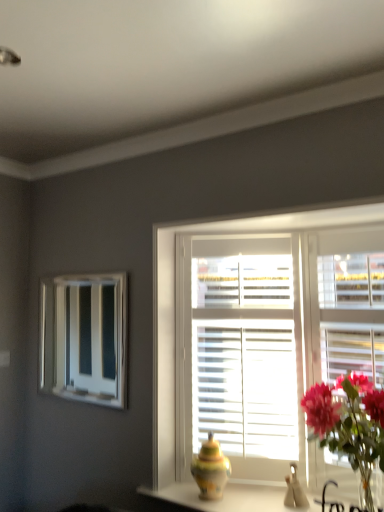
Identify the location of free region on the left part of multicolored ceramic vase at center. The width and height of the screenshot is (384, 512). (180, 490).